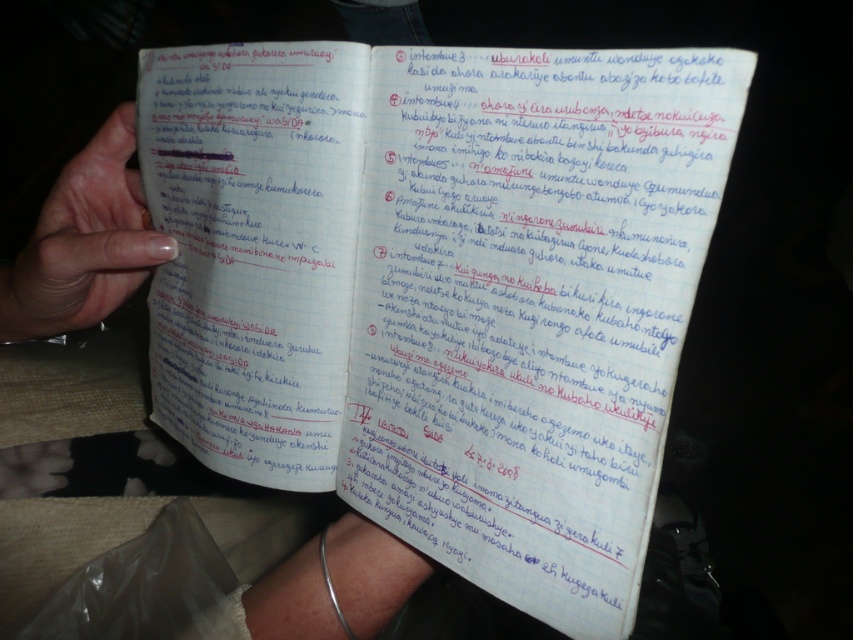
You are a teacher checking a student notebook. You notice the white lined paper at center and the nail polish at left. Which object is closer to the bottom of the notebook page?

The white lined paper at center is positioned under the nail polish at left, so the nail polish at left is closer to the bottom of the notebook page.